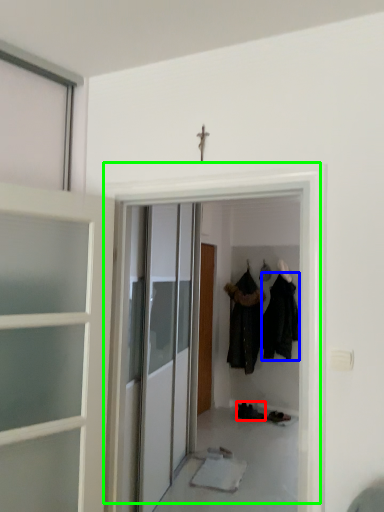
Question: Estimate the real-world distances between objects in this image. Which object is closer to footwear (highlighted by a red box), clothing (highlighted by a blue box) or door (highlighted by a green box)?

Choices:
 (A) clothing
 (B) door

Answer: (A)